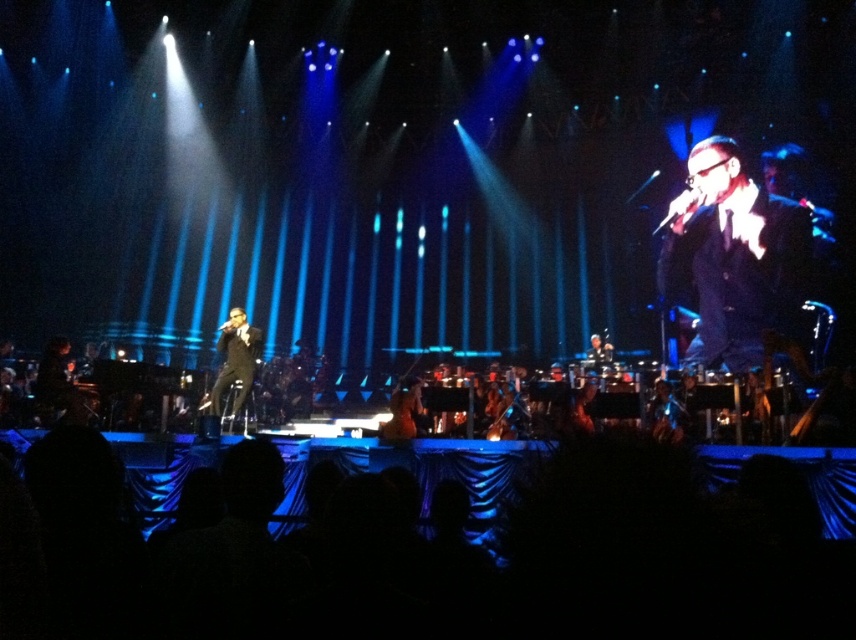
Question: Which of the following is the farthest from the observer?

Choices:
 (A) 223,346
 (B) 666,272

Answer: (B)

Question: Does black glossy suit at center have a lesser width compared to black glossy suit at left?

Choices:
 (A) no
 (B) yes

Answer: (B)

Question: Is black glossy suit at center positioned before black glossy suit at left?

Choices:
 (A) yes
 (B) no

Answer: (A)

Question: Which object is farther from the camera taking this photo?

Choices:
 (A) black glossy suit at center
 (B) black glossy suit at left

Answer: (B)

Question: Which of the following is the farthest from the observer?

Choices:
 (A) black glossy suit at center
 (B) black glossy suit at left

Answer: (B)

Question: Does black glossy suit at center have a larger size compared to black glossy suit at left?

Choices:
 (A) yes
 (B) no

Answer: (B)